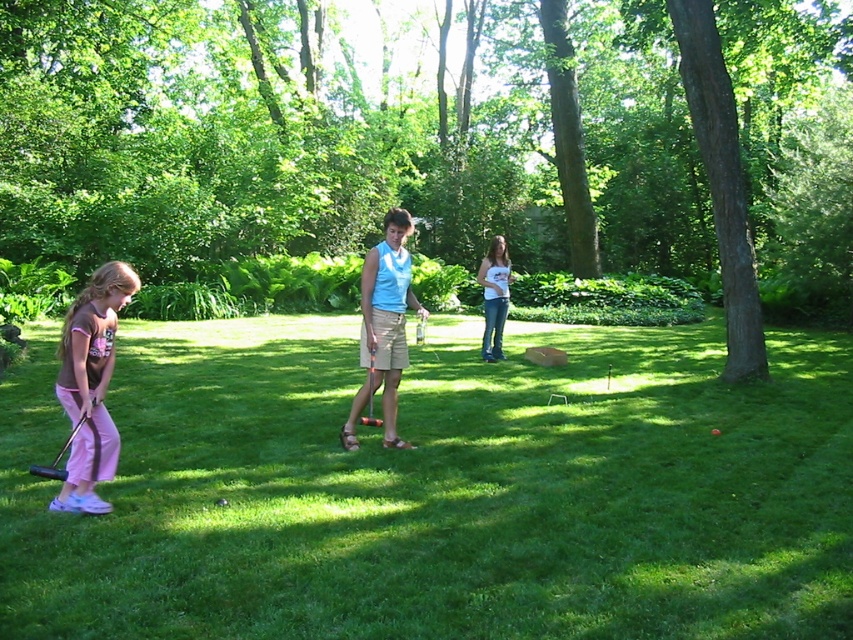
You are a photographer trying to capture a group photo of the light blue fabric shirt at center and the white cotton shirt at center. Since you want to ensure both subjects are in focus, you need to know their heights. Which of the two is shorter?

The light blue fabric shirt at center is not as tall as the white cotton shirt at center, so the light blue fabric shirt at center is shorter.